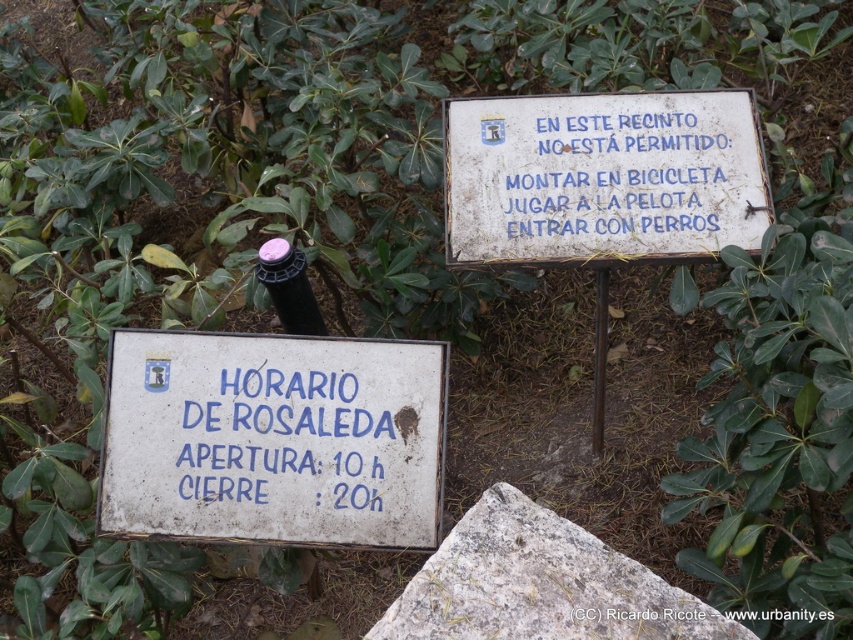
Can you confirm if gray granite stone at center is smaller than pink plastic wine bottle at center?

Incorrect, gray granite stone at center is not smaller in size than pink plastic wine bottle at center.

Who is higher up, gray granite stone at center or pink plastic wine bottle at center?

pink plastic wine bottle at center

Image resolution: width=853 pixels, height=640 pixels. Find the location of `gray granite stone at center`. gray granite stone at center is located at coordinates (540, 584).

Who is taller, white painted wood sign at upper center or pink plastic wine bottle at center?

white painted wood sign at upper center

At what (x,y) coordinates should I click in order to perform the action: click on white painted wood sign at upper center. Please return your answer as a coordinate pair (x, y). Looking at the image, I should click on (602, 177).

Locate an element on the screen. This screenshot has height=640, width=853. white painted wood sign at upper center is located at coordinates (602, 177).

Who is positioned more to the right, white painted metal sign at center or pink plastic wine bottle at center?

From the viewer's perspective, white painted metal sign at center appears more on the right side.

Is white painted metal sign at center to the left of pink plastic wine bottle at center from the viewer's perspective?

No, white painted metal sign at center is not to the left of pink plastic wine bottle at center.

Does point (352, 460) come behind point (282, 284)?

No, (352, 460) is closer to viewer.

This screenshot has height=640, width=853. Find the location of `white painted metal sign at center`. white painted metal sign at center is located at coordinates (273, 440).